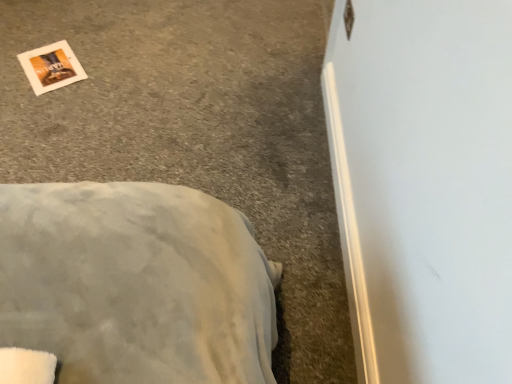
This screenshot has height=384, width=512. I want to click on vacant area on the back side of white paper at upper left, so click(x=64, y=30).